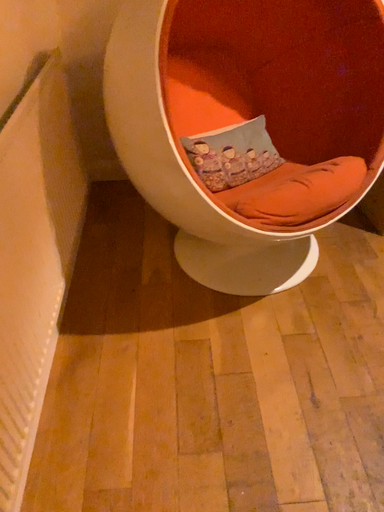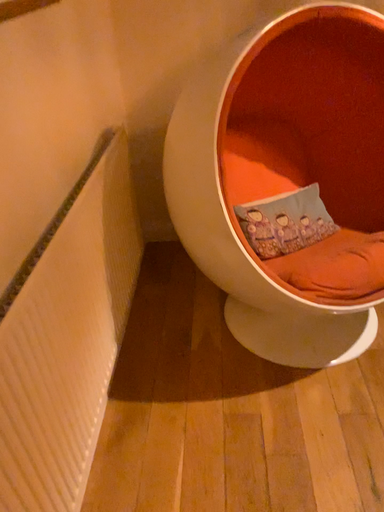
Question: Which way did the camera rotate in the video?

Choices:
 (A) rotated right
 (B) rotated left

Answer: (B)